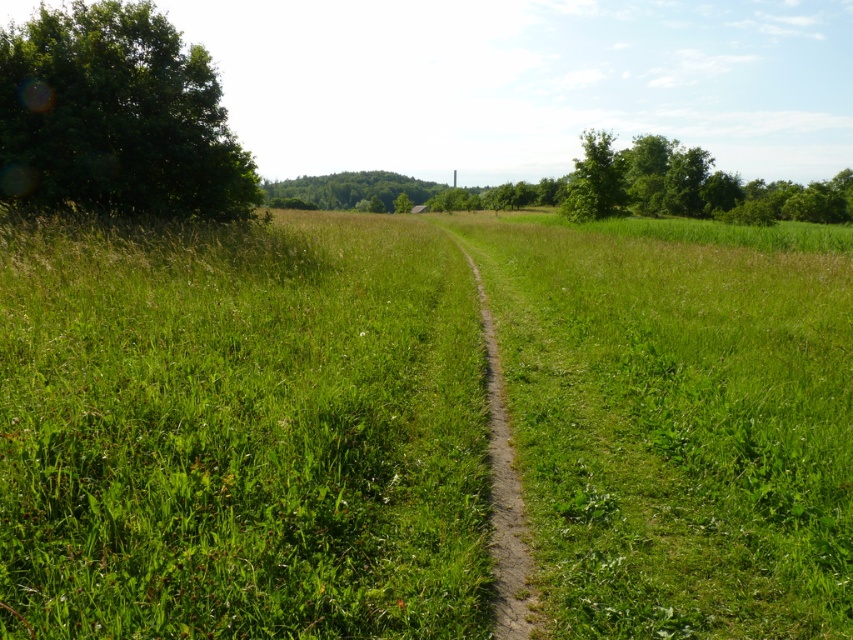
You are a hiker trying to decide which tree to rest under. You prefer a wider tree for shade. Based on the scene, which tree should you choose between the green leafy tree at left and the green leafy tree at center?

The green leafy tree at center is wider than the green leafy tree at left, so you should choose the green leafy tree at center for shade.